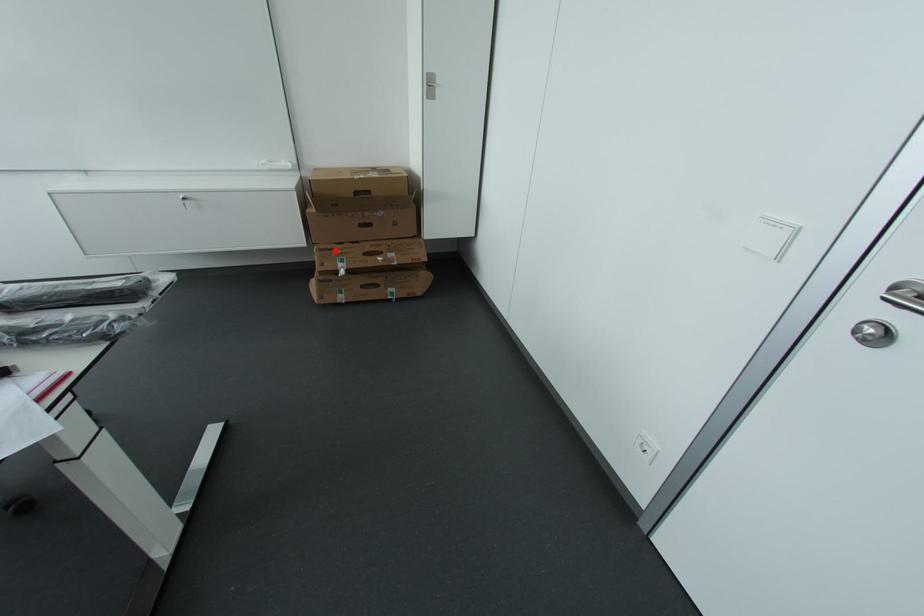
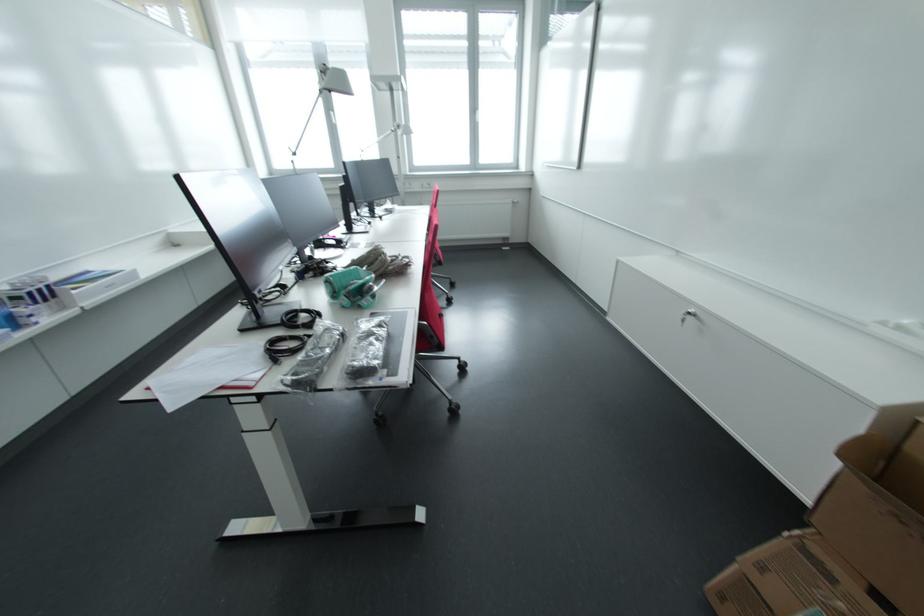
Question: I am providing you with two images of the same scene from different viewpoints. Given a red point in image1, look at the same physical point in image2. Is it:

Choices:
 (A) Closer to the viewpoint
 (B) Farther from the viewpoint

Answer: (B)